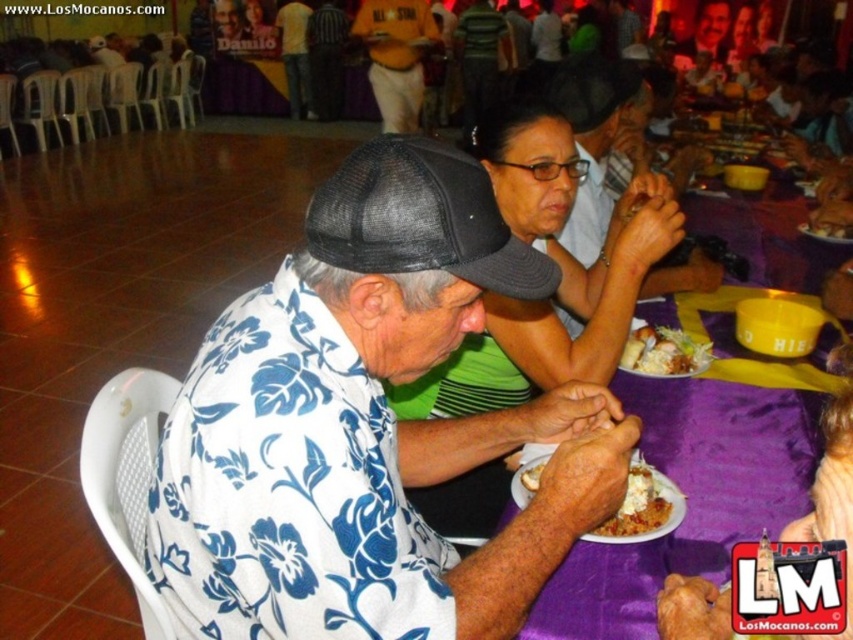
You are a photographer at the event and need to capture a photo of both the white floral shirt at center and the white creamy dessert at center. Since both are at the center, which one might appear closer to the camera in the photo?

The white floral shirt at center has a larger size compared to the white creamy dessert at center, so it will appear closer to the camera in the photo.

You are a server at this banquet hall and need to deliver a drink to the guest wearing the yellow shirt at upper left. You are currently standing next to the white creamy pasta at lower center. Can you reach the guest without walking more than 30 feet?

The distance between the white creamy pasta at lower center and the yellow shirt at upper left is 27.59 feet, so yes, you can reach the guest within the 30 feet limit.

You are a photographer at the event and want to capture a photo of both the white floral shirt at center and the matte black cap at upper center. Which object should you focus on first to ensure both are in the frame?

The white floral shirt at center is positioned under the matte black cap at upper center. To ensure both are in the frame, focus on the matte black cap at upper center first, as it is above the shirt and closer to the top of the image, allowing the shirt to be captured below it.